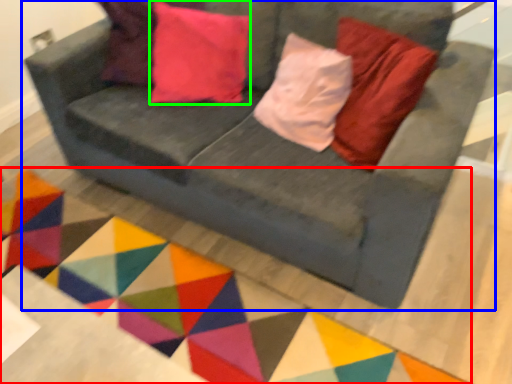
Question: Based on their relative distances, which object is nearer to mat (highlighted by a red box)? Choose from studio couch (highlighted by a blue box) and pillow (highlighted by a green box).

Choices:
 (A) studio couch
 (B) pillow

Answer: (A)